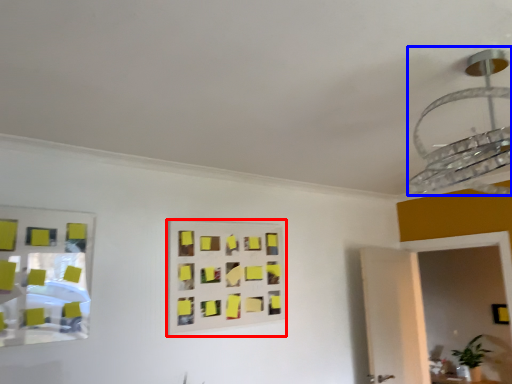
Question: Which of the following is the closest to the observer, rectangle (highlighted by a red box) or lamp (highlighted by a blue box)?

Choices:
 (A) rectangle
 (B) lamp

Answer: (B)